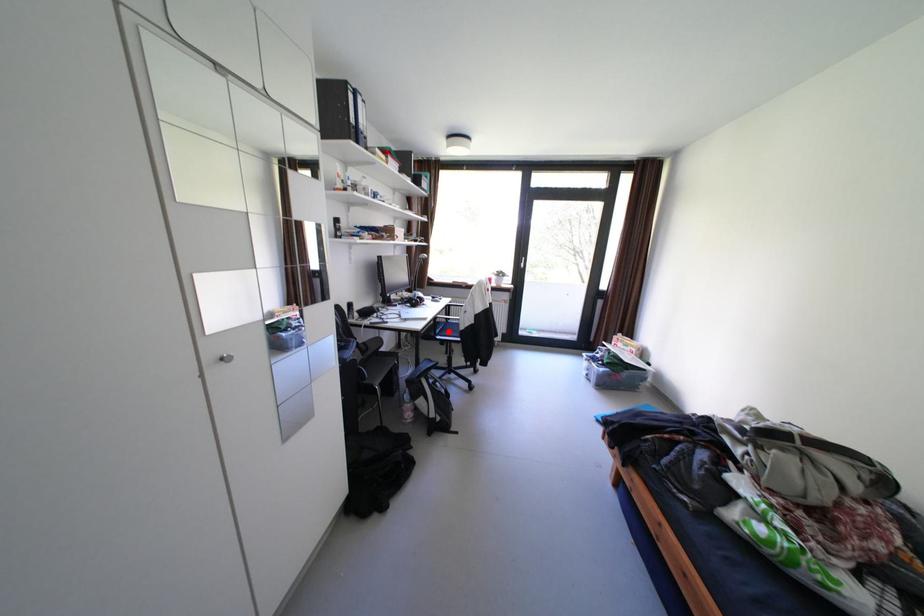
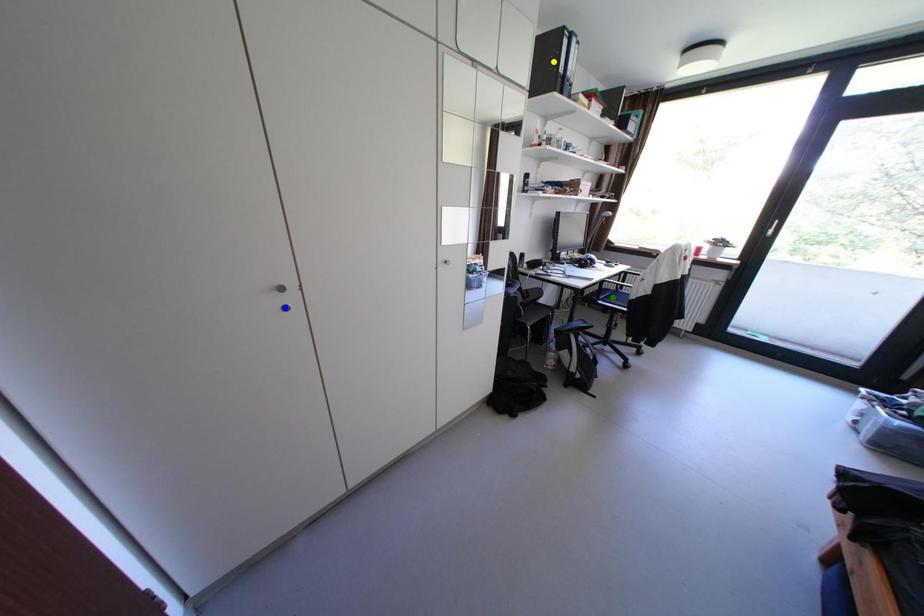
Question: I am providing you with two images of the same scene from different viewpoints. A red point is marked on the first image. You are given multiple points on the second image. Which point in image 2 represents the same 3d spot as the red point in image 1?

Choices:
 (A) yellow point
 (B) green point
 (C) blue point

Answer: (B)